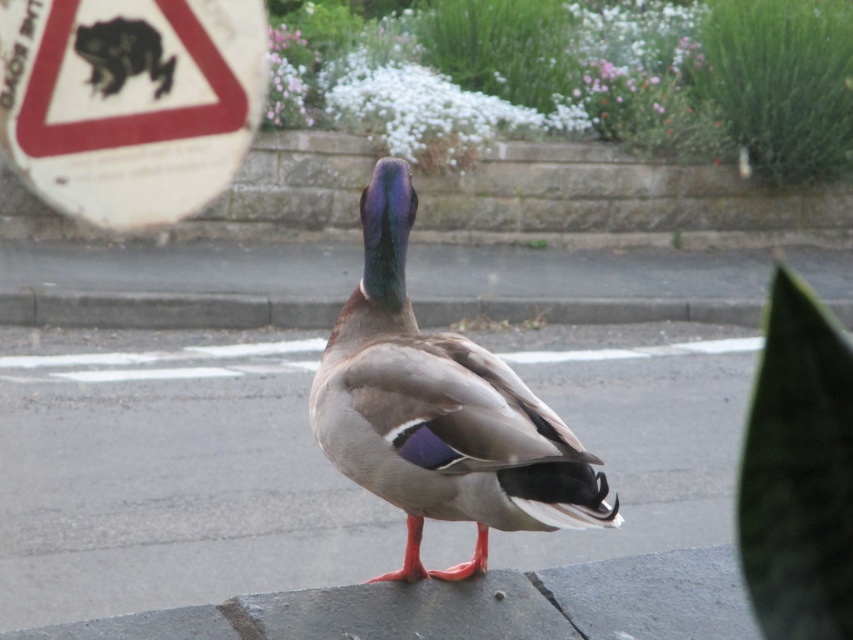
Between point (442, 396) and point (155, 307), which one is positioned behind?

The point (155, 307) is behind.

Is point (445, 365) closer to viewer compared to point (509, 317)?

Yes.

The height and width of the screenshot is (640, 853). What do you see at coordinates (439, 410) in the screenshot? I see `brown feathered duck at center` at bounding box center [439, 410].

Identify the location of brown feathered duck at center. (439, 410).

Who is positioned more to the right, white paper sign at upper left or gray concrete curb at lower center?

gray concrete curb at lower center is more to the right.

I want to click on white paper sign at upper left, so click(x=131, y=100).

Who is lower down, brown feathered duck at center or white paper sign at upper left?

brown feathered duck at center is lower down.

Which is behind, point (340, 429) or point (67, 64)?

Point (67, 64)

You are a GUI agent. You are given a task and a screenshot of the screen. Output one action in this format:
    pyautogui.click(x=<x>, y=<y>)
    Task: Click on the brown feathered duck at center
    
    Given the screenshot: What is the action you would take?
    pyautogui.click(x=439, y=410)